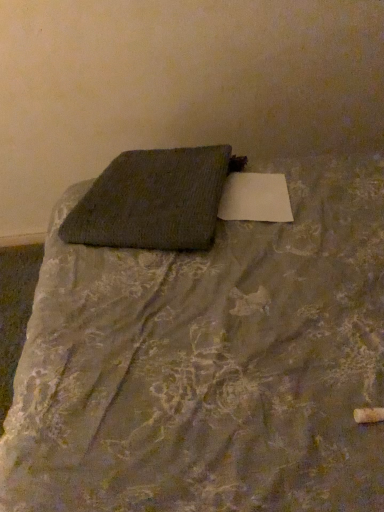
Question: Considering the relative positions of textured gray pillow at center and textured gray fabric at center in the image provided, is textured gray pillow at center to the left or to the right of textured gray fabric at center?

Choices:
 (A) right
 (B) left

Answer: (B)

Question: In terms of width, does textured gray pillow at center look wider or thinner when compared to textured gray fabric at center?

Choices:
 (A) thin
 (B) wide

Answer: (A)

Question: Is textured gray pillow at center bigger or smaller than textured gray fabric at center?

Choices:
 (A) small
 (B) big

Answer: (A)

Question: Is textured gray fabric at center to the left or to the right of textured gray pillow at center in the image?

Choices:
 (A) right
 (B) left

Answer: (A)

Question: From the image's perspective, is textured gray fabric at center located above or below textured gray pillow at center?

Choices:
 (A) above
 (B) below

Answer: (B)

Question: Is point (246, 402) positioned closer to the camera than point (203, 214)?

Choices:
 (A) farther
 (B) closer

Answer: (B)

Question: Considering the positions of textured gray fabric at center and textured gray pillow at center in the image, is textured gray fabric at center taller or shorter than textured gray pillow at center?

Choices:
 (A) short
 (B) tall

Answer: (B)